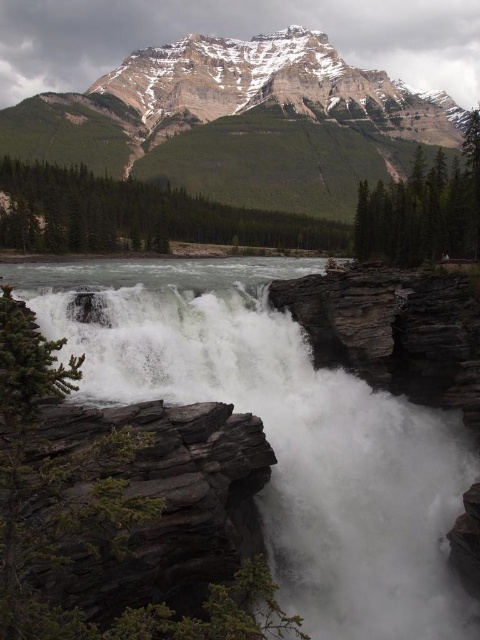
Based on the scene, which object is smaller in size between the white frothy water at center and the snowy rocky mountain at upper center?

The white frothy water at center is smaller in size compared to the snowy rocky mountain at upper center.

You are a photographer positioned at the base of the waterfall. You want to capture both the white frothy water at center and the dark gray rock at lower left in a single shot. Based on their positions, which object should you adjust your camera to focus on first to ensure both are in frame?

Since the white frothy water at center is to the left of the dark gray rock at lower left, you should first focus on the dark gray rock at lower left to ensure both are within the frame.

You are a hiker standing at the base of the waterfall. You want to take a photo of the white frothy water at center from a safe distance. The recommended safe distance from the waterfall is 50 meters to avoid the mist and spray. Can you safely take the photo from your current position?

The white frothy water at center and viewer are 52.39 meters apart, so yes, you can safely take the photo from your current position since the distance exceeds the recommended 50 meters.